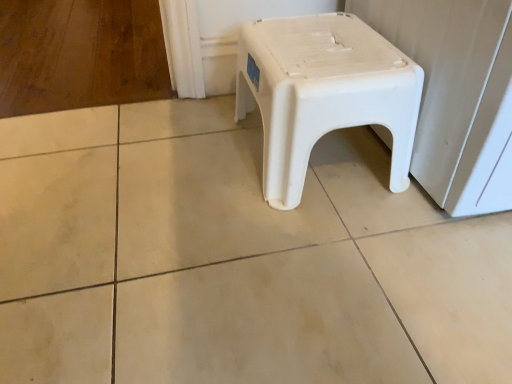
Describe the element at coordinates (454, 90) in the screenshot. The width and height of the screenshot is (512, 384). I see `white plastic stool at center-right` at that location.

Identify the location of white plastic stool at center-right. This screenshot has height=384, width=512. (454, 90).

You are a GUI agent. You are given a task and a screenshot of the screen. Output one action in this format:
    pyautogui.click(x=<x>, y=<y>)
    Task: Click on the white plastic stool at center
    The image size is (512, 384).
    Given the screenshot: What is the action you would take?
    pyautogui.click(x=323, y=93)

Describe the element at coordinates (323, 93) in the screenshot. I see `white plastic stool at center` at that location.

Locate an element on the screen. white plastic stool at center-right is located at coordinates (454, 90).

Would you say white plastic stool at center-right is to the left or to the right of white plastic stool at center in the picture?

white plastic stool at center-right is positioned on white plastic stool at center's right side.

Which is in front, white plastic stool at center-right or white plastic stool at center?

white plastic stool at center-right is more forward.

Does point (473, 124) come behind point (385, 69)?

That is False.

From the image's perspective, is white plastic stool at center-right above or below white plastic stool at center?

From the image's perspective, white plastic stool at center-right appears above white plastic stool at center.

From a real-world perspective, is white plastic stool at center-right positioned above or below white plastic stool at center?

Clearly, from a real-world perspective, white plastic stool at center-right is above white plastic stool at center.

Can you confirm if white plastic stool at center-right is wider than white plastic stool at center?

Yes.

Who is taller, white plastic stool at center-right or white plastic stool at center?

white plastic stool at center-right.

Which of these two, white plastic stool at center-right or white plastic stool at center, is smaller?

Smaller between the two is white plastic stool at center.

Is white plastic stool at center-right located outside white plastic stool at center?

Indeed, white plastic stool at center-right is completely outside white plastic stool at center.

Does white plastic stool at center-right touch white plastic stool at center?

No, white plastic stool at center-right is not in contact with white plastic stool at center.

Could you tell me if white plastic stool at center-right is turned towards white plastic stool at center?

No, white plastic stool at center-right is not aimed at white plastic stool at center.

The height and width of the screenshot is (384, 512). I want to click on stool below the white plastic stool at center-right (from the image's perspective), so click(323, 93).

Would you say white plastic stool at center is to the left or to the right of white plastic stool at center-right in the picture?

white plastic stool at center is positioned on white plastic stool at center-right's left side.

Is white plastic stool at center positioned before white plastic stool at center-right?

No, it is not.

Which point is more forward, (405, 160) or (415, 60)?

Point (415, 60)

From the image's perspective, is white plastic stool at center under white plastic stool at center-right?

Yes.

From a real-world perspective, relative to white plastic stool at center-right, is white plastic stool at center vertically above or below?

In terms of real-world spatial position, white plastic stool at center is below white plastic stool at center-right.

Considering the sizes of objects white plastic stool at center and white plastic stool at center-right in the image provided, who is thinner, white plastic stool at center or white plastic stool at center-right?

With smaller width is white plastic stool at center.

Can you confirm if white plastic stool at center is shorter than white plastic stool at center-right?

Yes, white plastic stool at center is shorter than white plastic stool at center-right.

Considering the relative sizes of white plastic stool at center and white plastic stool at center-right in the image provided, is white plastic stool at center bigger than white plastic stool at center-right?

Actually, white plastic stool at center might be smaller than white plastic stool at center-right.

Do you think white plastic stool at center is within white plastic stool at center-right, or outside of it?

white plastic stool at center lies outside white plastic stool at center-right.

Is white plastic stool at center next to white plastic stool at center-right?

No, white plastic stool at center is not touching white plastic stool at center-right.

Is white plastic stool at center facing away from white plastic stool at center-right?

No, white plastic stool at center's orientation is not away from white plastic stool at center-right.

Consider the image. What's the angular difference between white plastic stool at center and white plastic stool at center-right's facing directions?

0.81 degrees.

The width and height of the screenshot is (512, 384). What are the coordinates of `stool that is under the white plastic stool at center-right (from a real-world perspective)` in the screenshot? It's located at (323, 93).

Where is `screen door that is in front of the white plastic stool at center`? This screenshot has height=384, width=512. screen door that is in front of the white plastic stool at center is located at coordinates (454, 90).

This screenshot has width=512, height=384. What are the coordinates of `stool below the white plastic stool at center-right (from the image's perspective)` in the screenshot? It's located at (323, 93).